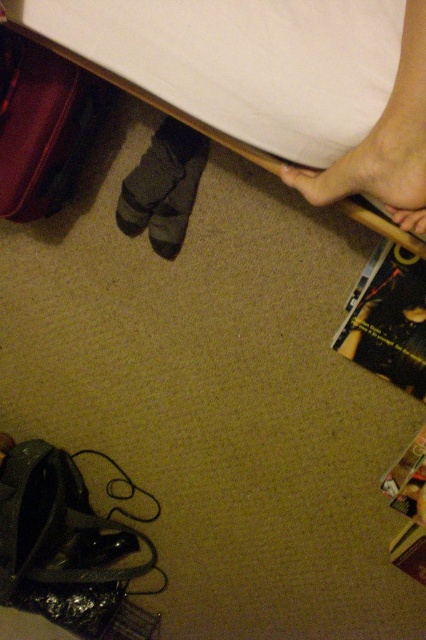
What do you see at coordinates (273, 77) in the screenshot? I see `white fabric bed at upper center` at bounding box center [273, 77].

Can you confirm if white fabric bed at upper center is positioned below black glossy magazine at lower right?

Actually, white fabric bed at upper center is above black glossy magazine at lower right.

The image size is (426, 640). Find the location of `white fabric bed at upper center`. white fabric bed at upper center is located at coordinates (273, 77).

Can you confirm if dark gray fabric sock at lower center is positioned above shiny metallic magazine at lower right?

Yes, dark gray fabric sock at lower center is above shiny metallic magazine at lower right.

Locate an element on the screen. This screenshot has height=640, width=426. dark gray fabric sock at lower center is located at coordinates (176, 208).

Who is positioned more to the right, white fabric bed at upper center or dark gray fabric sock at lower center?

white fabric bed at upper center is more to the right.

At what (x,y) coordinates should I click in order to perform the action: click on white fabric bed at upper center. Please return your answer as a coordinate pair (x, y). This screenshot has width=426, height=640. Looking at the image, I should click on (273, 77).